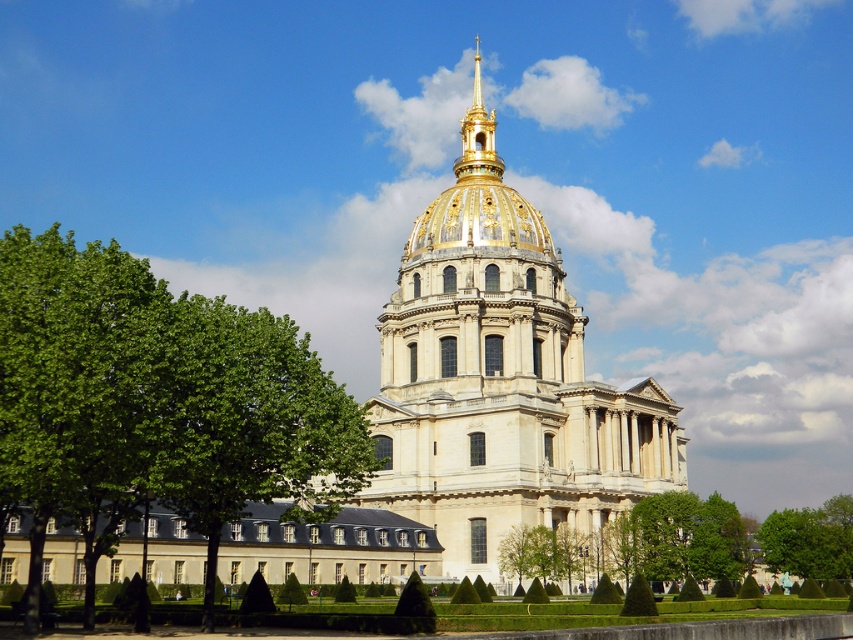
Can you confirm if green leafy tree at left is taller than green leafy tree at lower right?

Indeed, green leafy tree at left has a greater height compared to green leafy tree at lower right.

Between green leafy tree at left and green leafy tree at lower right, which one is positioned higher?

green leafy tree at left is higher up.

The height and width of the screenshot is (640, 853). What do you see at coordinates (155, 403) in the screenshot?
I see `green leafy tree at left` at bounding box center [155, 403].

Image resolution: width=853 pixels, height=640 pixels. What are the coordinates of `green leafy tree at left` in the screenshot? It's located at (155, 403).

Looking at this image, which of these two, golden dome building at center or gold plated spire at upper center, stands taller?

Standing taller between the two is gold plated spire at upper center.

Who is more forward, (439, 262) or (467, 124)?

Point (439, 262) is in front.

Locate an element on the screen. This screenshot has width=853, height=640. golden dome building at center is located at coordinates pos(502,388).

Which is more to the left, green leafy tree at left or gold plated spire at upper center?

Positioned to the left is green leafy tree at left.

Does green leafy tree at left have a smaller size compared to gold plated spire at upper center?

No.

Is point (0, 292) behind point (471, 154)?

No, it is not.

What are the coordinates of `green leafy tree at left` in the screenshot? It's located at (155, 403).